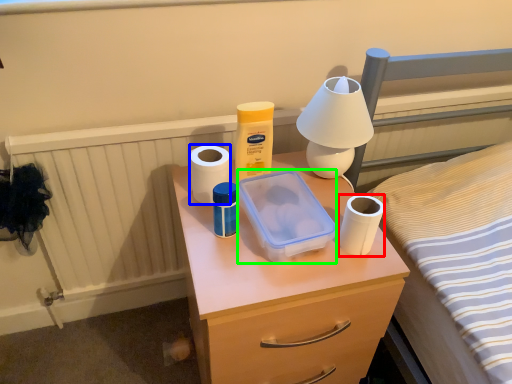
Question: Estimate the real-world distances between objects in this image. Which object is farther from toilet paper (highlighted by a red box), toilet paper (highlighted by a blue box) or storage box (highlighted by a green box)?

Choices:
 (A) toilet paper
 (B) storage box

Answer: (A)